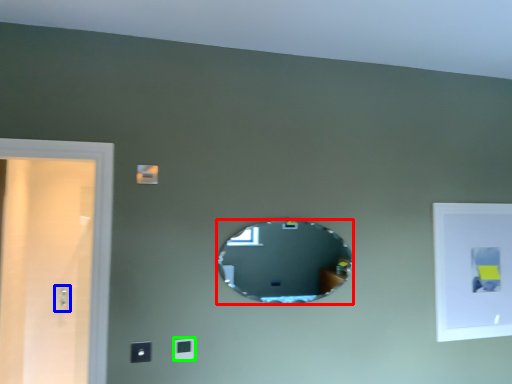
Question: Estimate the real-world distances between objects in this image. Which object is farther from mirror (highlighted by a red box), electric outlet (highlighted by a blue box) or light switch (highlighted by a green box)?

Choices:
 (A) electric outlet
 (B) light switch

Answer: (A)